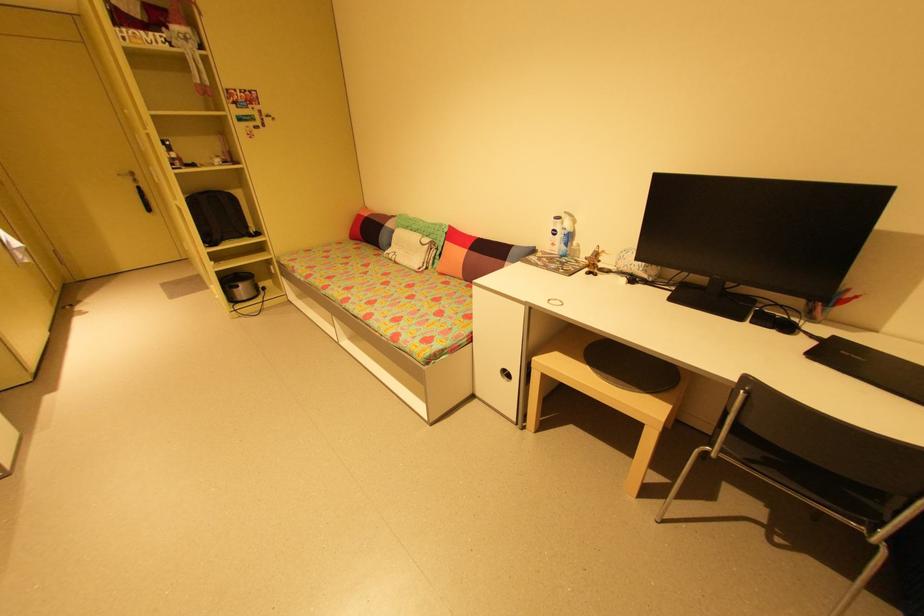
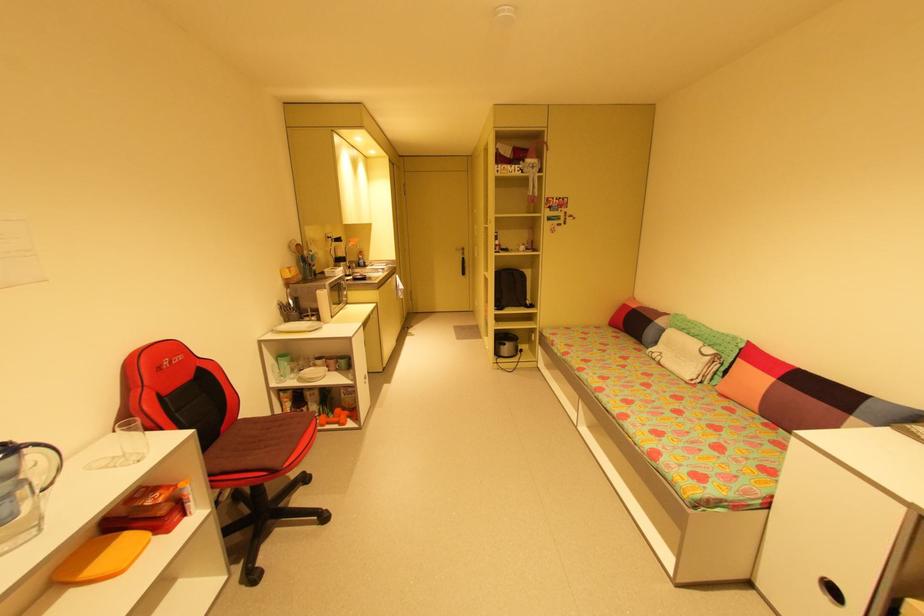
Locate, in the second image, the point that corresponds to [239,291] in the first image.

(505, 347)